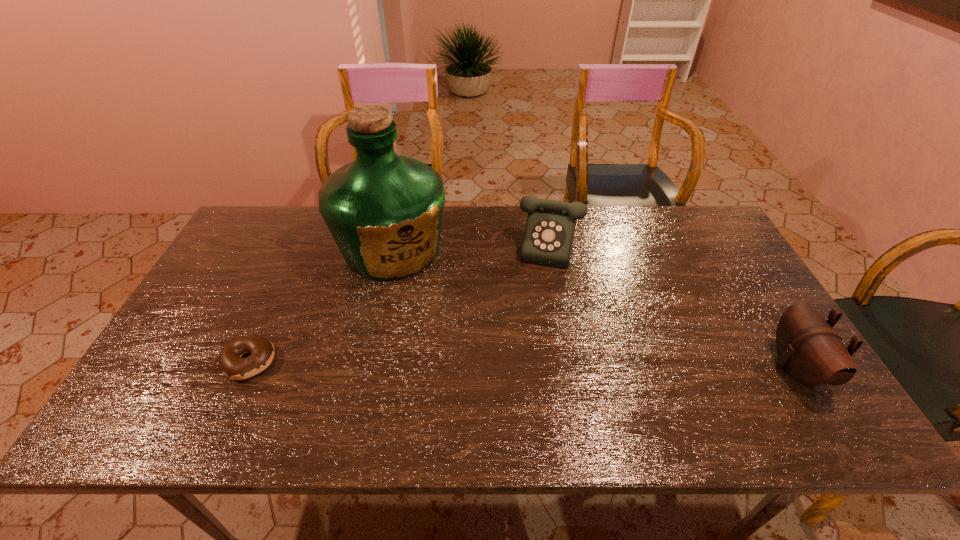
Identify the location of free space between the pouch and the second object from right to left. Image resolution: width=960 pixels, height=540 pixels. (681, 308).

In order to click on free space between the third object from left to right and the liquor in this screenshot , I will do `click(479, 248)`.

This screenshot has height=540, width=960. I want to click on unoccupied position between the shortest object and the telephone, so click(x=408, y=305).

What are the coordinates of `vacant point located between the telephone and the leftmost object` in the screenshot? It's located at (x=408, y=305).

Find the location of a particular element. The width and height of the screenshot is (960, 540). vacant area that lies between the second object from left to right and the doughnut is located at coordinates (321, 305).

Image resolution: width=960 pixels, height=540 pixels. In order to click on empty space that is in between the rightmost object and the doughnut in this screenshot , I will do `click(522, 364)`.

The height and width of the screenshot is (540, 960). In order to click on free space between the rightmost object and the doughnut in this screenshot , I will do `click(522, 364)`.

The height and width of the screenshot is (540, 960). In order to click on the closest object to the leftmost object in this screenshot , I will do `click(384, 211)`.

Locate an element on the screen. The image size is (960, 540). the third closest object to the third object from left to right is located at coordinates click(x=231, y=363).

Find the location of a particular element. The height and width of the screenshot is (540, 960). vacant position in the image that satisfies the following two spatial constraints: 1. on the front side of the pouch; 2. with the flap open on the second object from left to right is located at coordinates (366, 368).